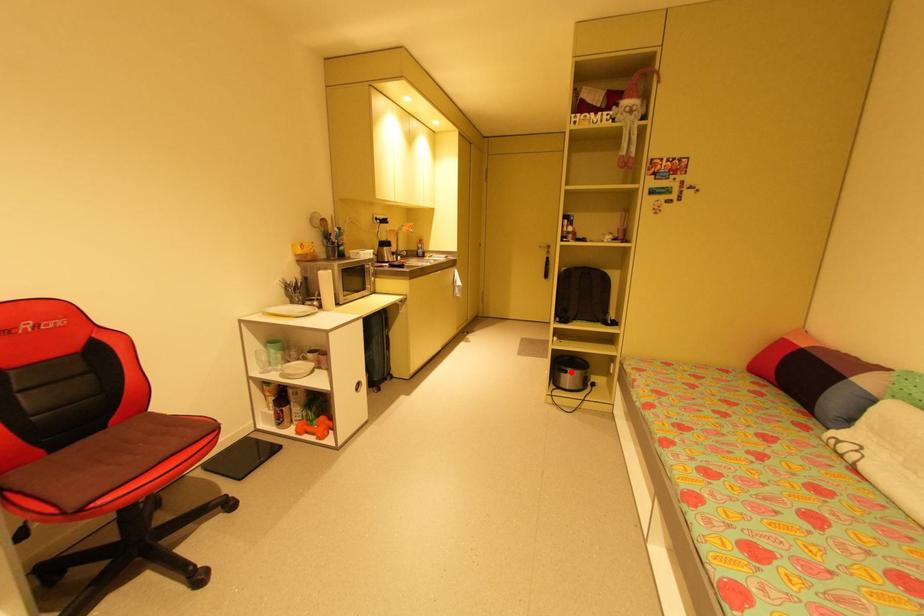
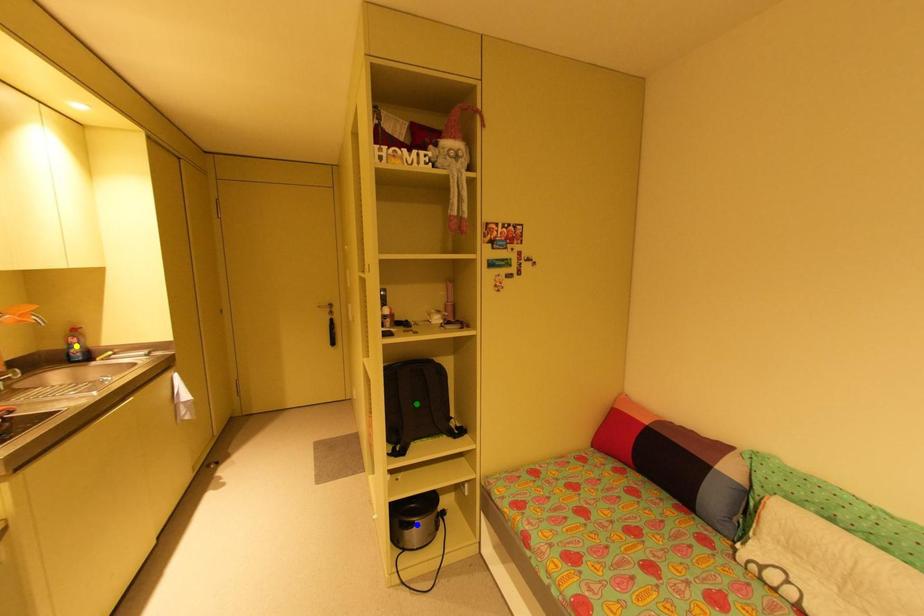
Question: I am providing you with two images of the same scene from different viewpoints. A red point is marked on the first image. You are given multiple points on the second image. Can you choose the point in image 2 that corresponds to the point in image 1?

Choices:
 (A) green point
 (B) blue point
 (C) yellow point

Answer: (B)